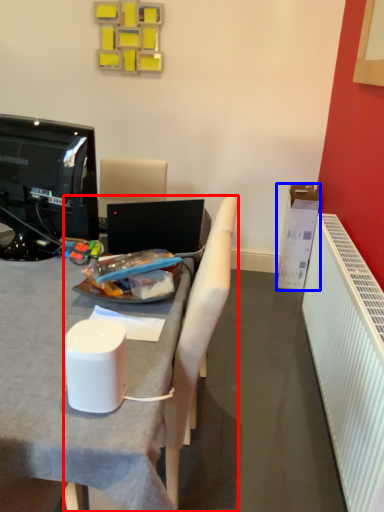
Question: Among these objects, which one is farthest to the camera, chair (highlighted by a red box) or box (highlighted by a blue box)?

Choices:
 (A) chair
 (B) box

Answer: (B)